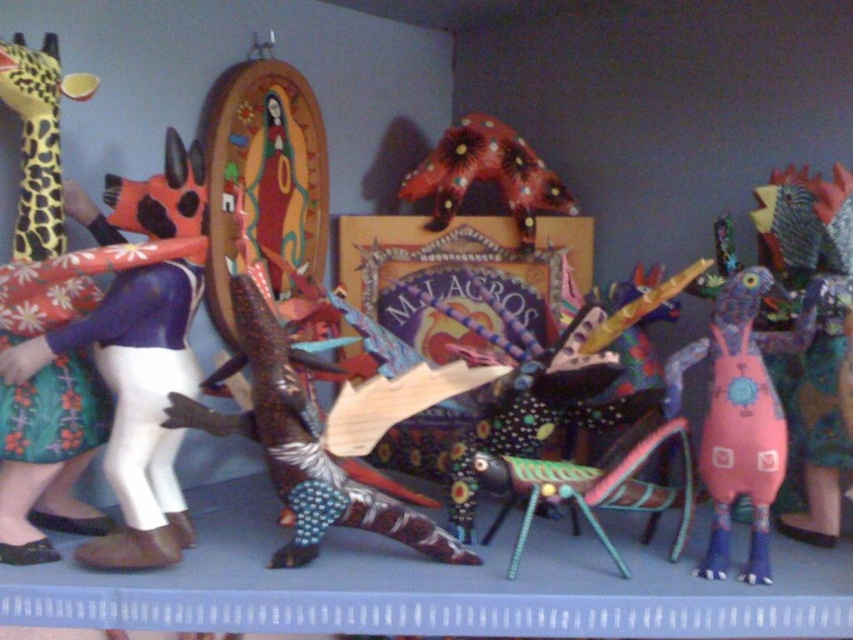
The height and width of the screenshot is (640, 853). Describe the element at coordinates (137, 349) in the screenshot. I see `matte purple fabric doll at left` at that location.

At what (x,y) coordinates should I click in order to perform the action: click on matte purple fabric doll at left. Please return your answer as a coordinate pair (x, y). Looking at the image, I should click on (137, 349).

Is matte purple fabric doll at left shorter than pink fabric bird at right?

In fact, matte purple fabric doll at left may be taller than pink fabric bird at right.

Locate an element on the screen. The width and height of the screenshot is (853, 640). matte purple fabric doll at left is located at coordinates (137, 349).

Is point (44, 232) positioned in front of point (828, 189)?

Yes, point (44, 232) is closer to viewer.

Is matte yellow giraffe at left bigger than pink fabric bird at right?

Indeed, matte yellow giraffe at left has a larger size compared to pink fabric bird at right.

Who is more distant from viewer, (38, 208) or (820, 458)?

The point (820, 458) is behind.

Identify the location of matte yellow giraffe at left. (48, 456).